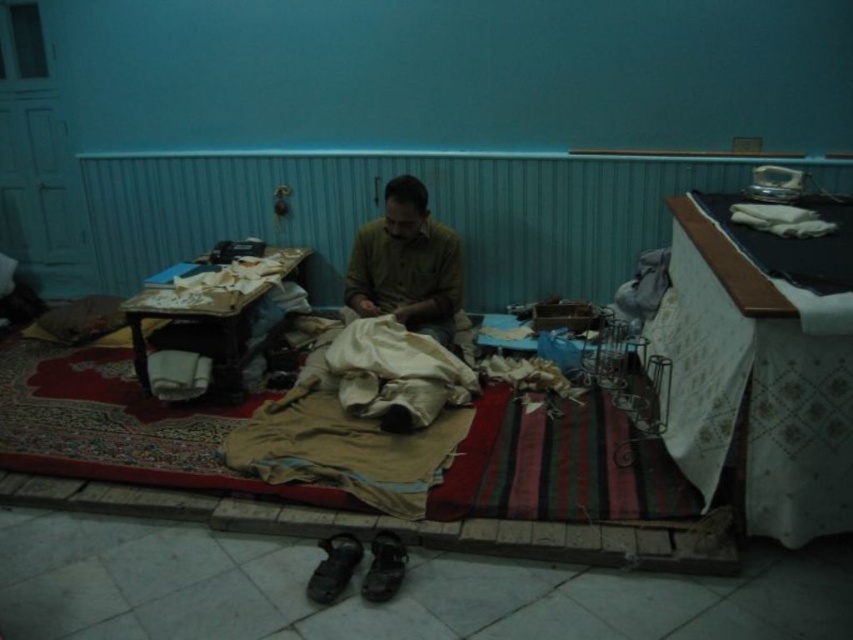
Is beige cotton blanket at center to the left of dark brown leather shoe at lower center from the viewer's perspective?

Yes, beige cotton blanket at center is to the left of dark brown leather shoe at lower center.

Which is in front, point (369, 454) or point (399, 547)?

Point (399, 547)

Is point (344, 396) positioned behind point (384, 536)?

Yes, it is.

In order to click on beige cotton blanket at center in this screenshot , I will do `click(354, 428)`.

Can you confirm if beige fabric mat at center is thinner than beige cotton blanket at center?

In fact, beige fabric mat at center might be wider than beige cotton blanket at center.

Between point (339, 492) and point (375, 465), which one is positioned in front?

Point (339, 492) is in front.

Where is `beige fabric mat at center`? The image size is (853, 640). beige fabric mat at center is located at coordinates (120, 426).

Between point (566, 512) and point (393, 272), which one is positioned in front?

Point (566, 512)

Can you confirm if beige fabric mat at center is wider than brown cotton shirt at center?

Yes, beige fabric mat at center is wider than brown cotton shirt at center.

Is point (521, 458) less distant than point (383, 284)?

Yes, point (521, 458) is closer to viewer.

Where is `beige fabric mat at center`? beige fabric mat at center is located at coordinates (120, 426).